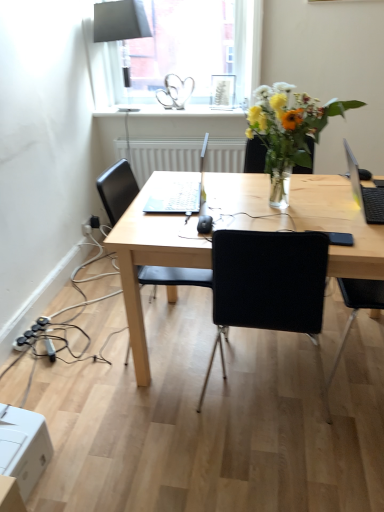
You are a GUI agent. You are given a task and a screenshot of the screen. Output one action in this format:
    pyautogui.click(x=<x>, y=<y>)
    Task: Click on the free area in between black plastic mouse at center and sleek silver laptop at center
    The height and width of the screenshot is (512, 384).
    Given the screenshot: What is the action you would take?
    pyautogui.click(x=192, y=215)